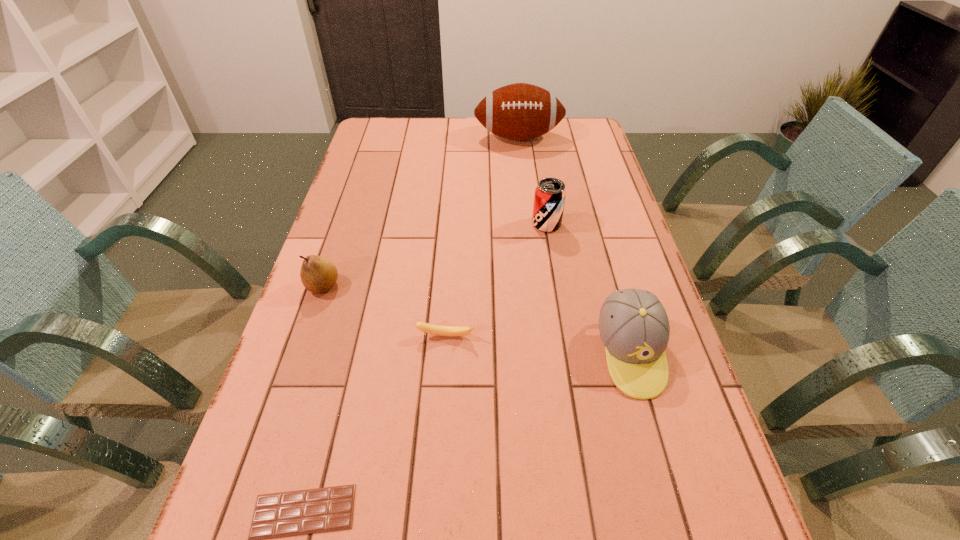
The height and width of the screenshot is (540, 960). Find the location of `free spot that satisfies the following two spatial constraints: 1. on the laces of the second farthest object; 2. on the left side of the farthest object`. free spot that satisfies the following two spatial constraints: 1. on the laces of the second farthest object; 2. on the left side of the farthest object is located at coordinates (529, 224).